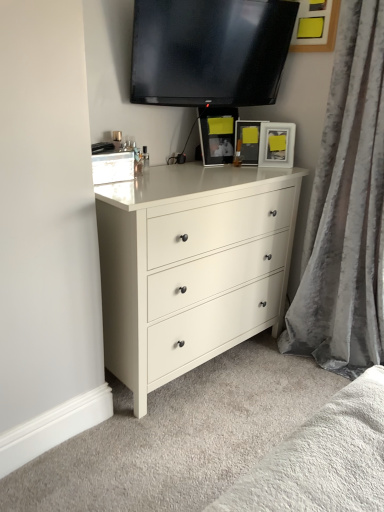
Find the location of a particular element. This screenshot has width=384, height=512. free space in front of matte black picture frame at upper right, marked as the 3th picture frame in a left-to-right arrangement is located at coordinates (271, 169).